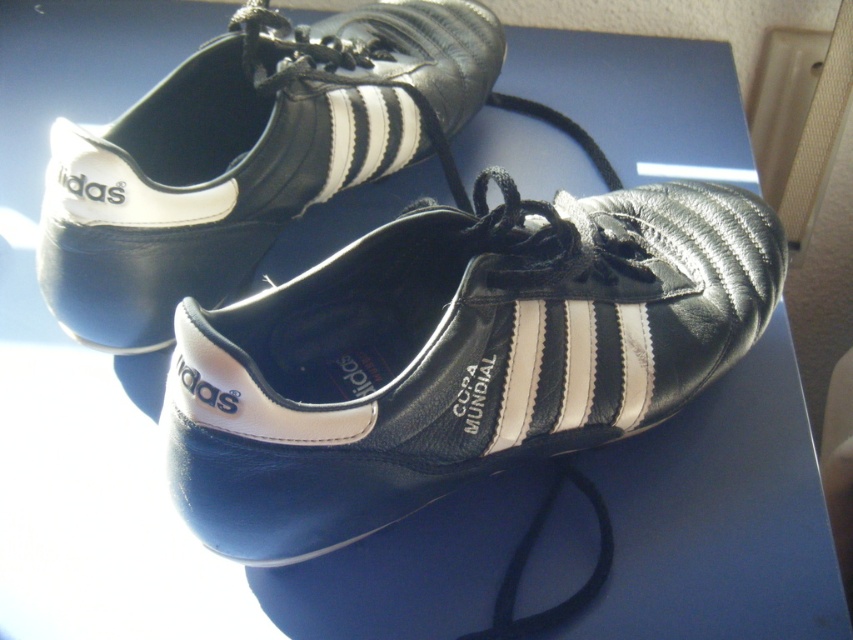
Does black leather shoe at center have a lesser height compared to shiny leather shoe at upper center?

Indeed, black leather shoe at center has a lesser height compared to shiny leather shoe at upper center.

Who is positioned more to the right, black leather shoe at center or shiny leather shoe at upper center?

black leather shoe at center

Does point (589, 214) lie in front of point (432, 92)?

Yes, it is in front of point (432, 92).

I want to click on black leather shoe at center, so click(x=457, y=355).